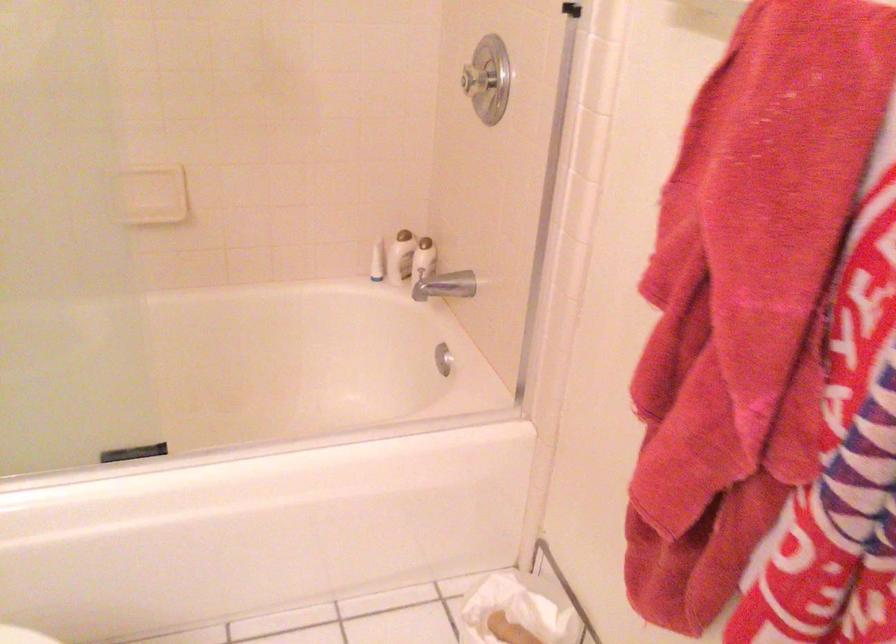
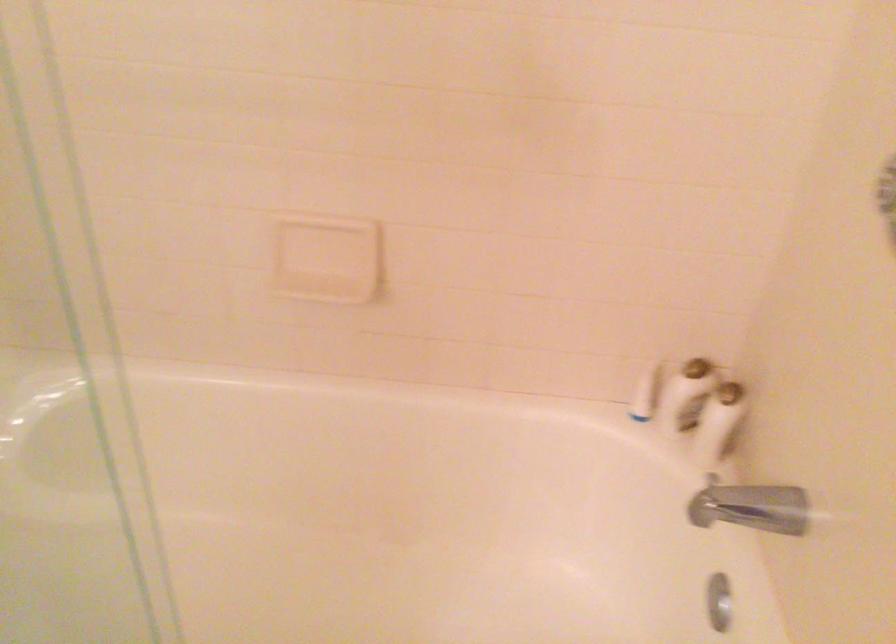
Where in the second image is the point corresponding to point 451,283 from the first image?

(757, 507)